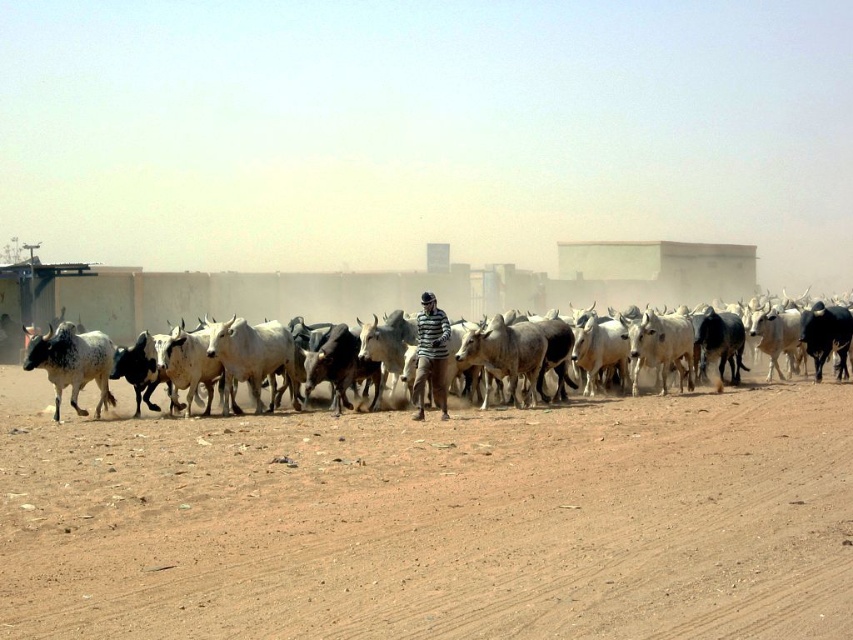
You are standing on the brown sandy dirt at center. Looking around, you see a shepherd in a striped shirt and dark pants guiding cattle along a dirt road. Where is the shepherd positioned relative to your location?

The shepherd in a striped shirt and dark pants is positioned slightly apart from the herd, which is moving along the dirt road, but the exact spatial relationship to your location on the brown sandy dirt at center isn

From the picture: You are a photographer trying to capture the speckled white cow at left and the brown sandy dirt at center in the same frame. Which object is higher in the image?

The speckled white cow at left is taller than the brown sandy dirt at center, so the speckled white cow at left appears higher in the image.